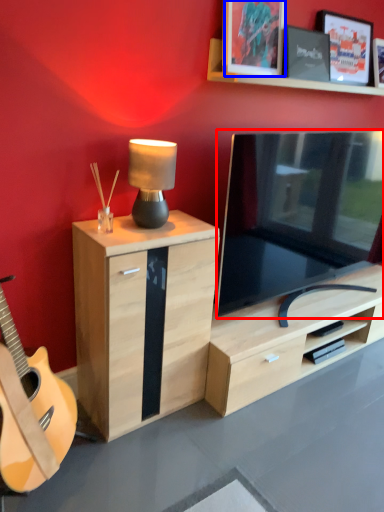
Question: Which of the following is the farthest to the observer, television (highlighted by a red box) or picture frame (highlighted by a blue box)?

Choices:
 (A) television
 (B) picture frame

Answer: (B)